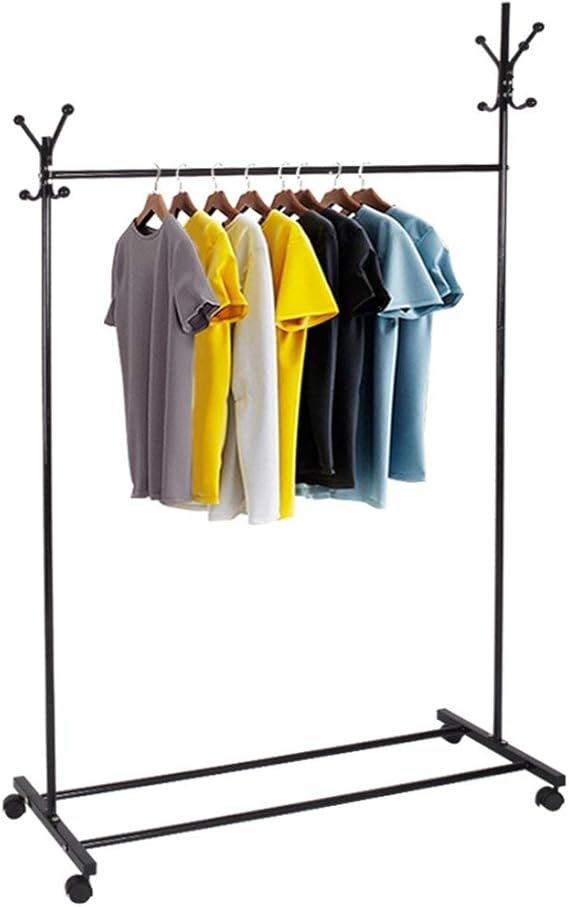
Find the location of a particular element. This screenshot has width=569, height=907. caster is located at coordinates (81, 890), (15, 811), (547, 795), (453, 736).